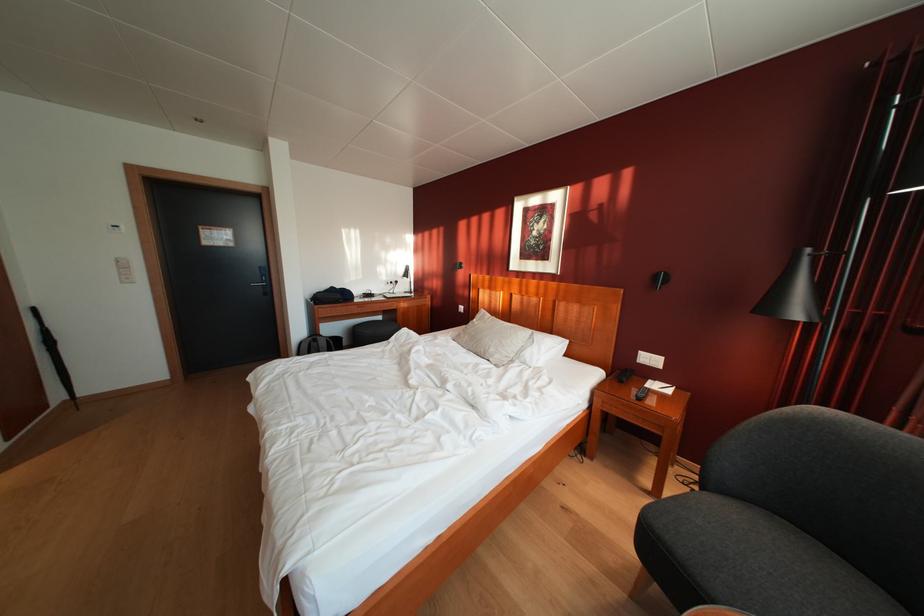
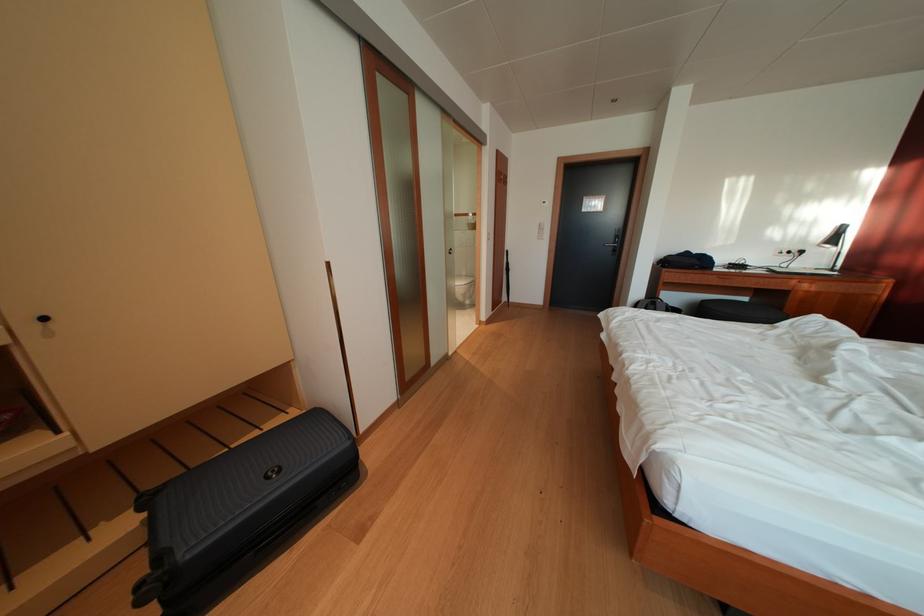
Where in the second image is the point corresponding to (387,323) from the first image?

(752, 305)